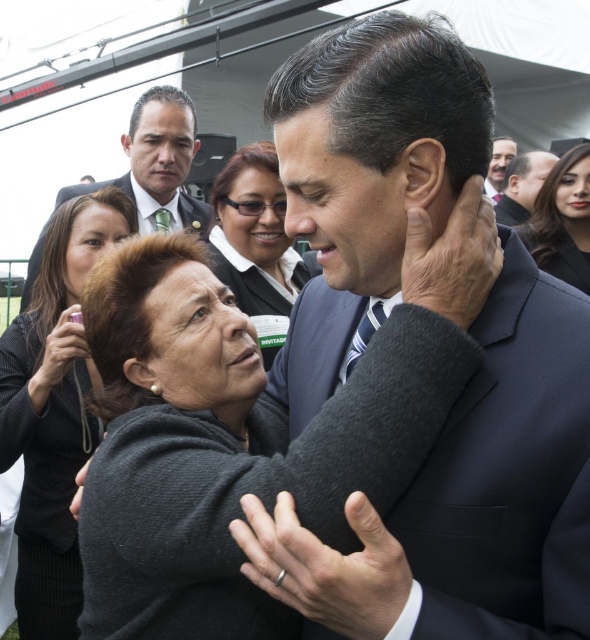
You are a photographer at the event and need to position yourself to capture both the matte black suit at upper center and the smooth black suit at upper right in the same frame. Which suit should you focus on to ensure both are visible without moving the camera?

The matte black suit at upper center is larger in size than the smooth black suit at upper right, so focusing on the matte black suit at upper center will help ensure both are visible in the frame.

You are a photographer at the event and need to position a spotlight. The spotlight can only be placed at coordinates between 0.2 and 0.3 on both the x and y axes. Is the matte black suit at upper center within this area?

The matte black suit at upper center is located at point coordinates of [158,161], which falls within the specified range of 0.2 to 0.3 on both axes. Therefore, the spotlight can be placed there to illuminate the matte black suit at upper center effectively.

You are a photographer at the event and want to capture a photo of the matte black suit at upper center and the smooth black hair at upper right. From the perspective of the photographer, which object is positioned to the right side?

The smooth black hair at upper right is positioned to the right of the matte black suit at upper center.